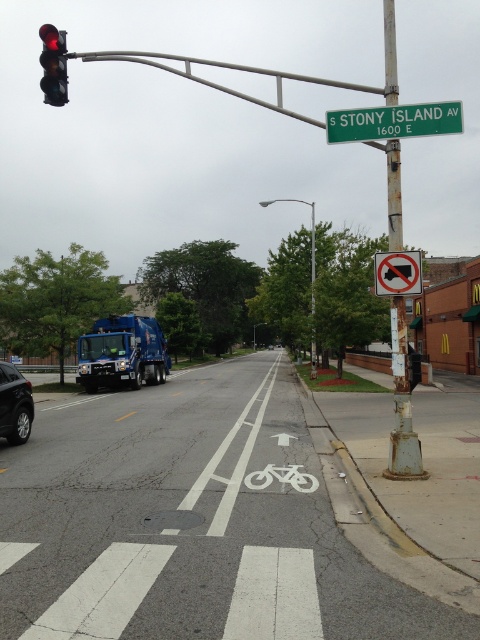
Who is more forward, (457, 129) or (24, 413)?

Positioned in front is point (457, 129).

Is the position of green plastic street sign at upper center more distant than that of silver metallic sedan at left?

No, green plastic street sign at upper center is closer to the viewer.

What do you see at coordinates (394, 122) in the screenshot? I see `green plastic street sign at upper center` at bounding box center [394, 122].

Locate an element on the screen. The height and width of the screenshot is (640, 480). green plastic street sign at upper center is located at coordinates (394, 122).

Is white painted bicycle lane at center wider than red glass traffic light at upper left?

No, white painted bicycle lane at center is not wider than red glass traffic light at upper left.

Which is in front, point (396, 600) or point (66, 74)?

Point (396, 600)

Image resolution: width=480 pixels, height=640 pixels. Identify the location of white painted bicycle lane at center. (191, 522).

Measure the distance between silver metallic sedan at left and red glass traffic light at upper left.

silver metallic sedan at left is 35.16 feet away from red glass traffic light at upper left.

Which is behind, point (26, 432) or point (41, 88)?

Point (41, 88)

Find the location of `silver metallic sedan at left`. silver metallic sedan at left is located at coordinates (14, 404).